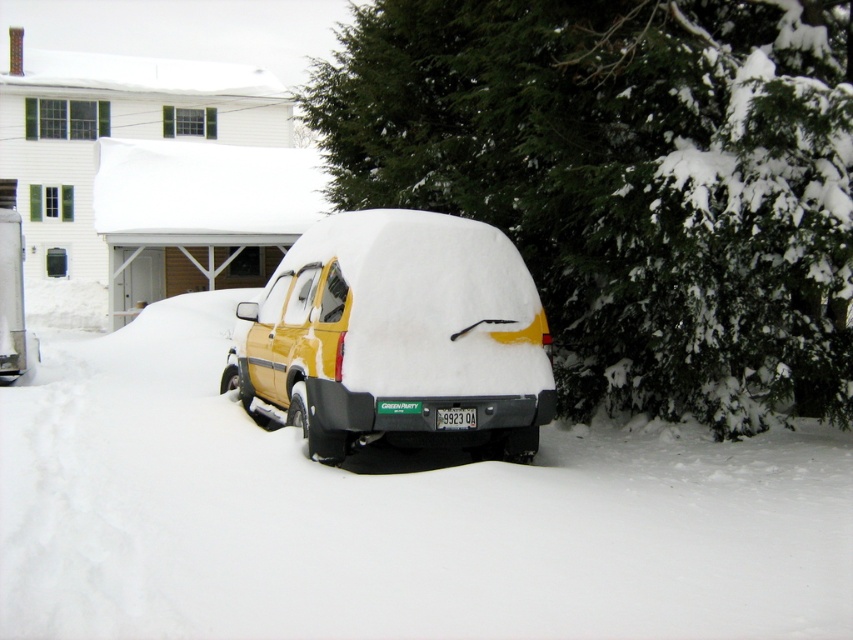
You are a delivery driver who needs to reach the house behind the yellow matte van at center. The white fluffy snow at center is blocking the path. Can you drive around the van without going through the snow?

The white fluffy snow at center is not as tall as the yellow matte van at center, so you can drive around the van on either side since the snow is lower than the van, allowing visibility and space to maneuver.

You are a delivery driver trying to reach the house with the light brown garage door. The yellow matte van at center is blocking the path. Can you pass through the area covered by the white fluffy snow at center?

The white fluffy snow at center might be wider than yellow matte van at center, so there is a possibility that the snow area is wide enough to allow passage around the van. However, since the exact width isn not specified, it is uncertain whether it will fit.